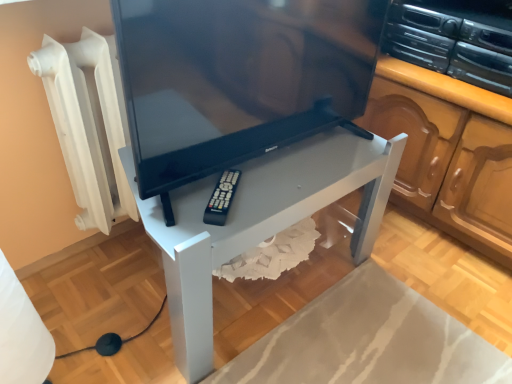
Where is `white glossy table at center`? This screenshot has height=384, width=512. white glossy table at center is located at coordinates (259, 221).

This screenshot has width=512, height=384. What do you see at coordinates (222, 198) in the screenshot?
I see `black plastic remote at lower center` at bounding box center [222, 198].

In order to face black plastic remote at lower center, should I rotate leftwards or rightwards?

It's best to rotate left around 4.134 degrees.

At what (x,y) coordinates should I click in order to perform the action: click on white glossy table at center. Please return your answer as a coordinate pair (x, y). The height and width of the screenshot is (384, 512). Looking at the image, I should click on (259, 221).

Is white glossy table at center far from black glossy tv at center?

That's not correct — white glossy table at center is a little close to black glossy tv at center.

Between white glossy table at center and black glossy tv at center, which one appears on the right side from the viewer's perspective?

From the viewer's perspective, black glossy tv at center appears more on the right side.

From the image's perspective, is white glossy table at center under black glossy tv at center?

Yes, from the image's perspective, white glossy table at center is beneath black glossy tv at center.

Can you see black glossy tv at center touching black plastic remote at lower center?

No, black glossy tv at center is not in contact with black plastic remote at lower center.

Based on the photo, is black glossy tv at center to the right of black plastic remote at lower center from the viewer's perspective?

Yes, black glossy tv at center is to the right of black plastic remote at lower center.

Could black plastic remote at lower center be considered to be inside black glossy tv at center?

Yes, black plastic remote at lower center is a part of black glossy tv at center.

From the image's perspective, would you say black glossy tv at center is positioned over black plastic stereo at upper right?

Actually, black glossy tv at center appears below black plastic stereo at upper right in the image.

Which point is more distant from viewer, (294,46) or (401,14)?

Point (401,14)

Is black glossy tv at center oriented away from black plastic stereo at upper right?

No, black plastic stereo at upper right is not at the back of black glossy tv at center.

Considering the sizes of black plastic remote at lower center and black plastic stereo at upper right in the image, is black plastic remote at lower center wider or thinner than black plastic stereo at upper right?

Clearly, black plastic remote at lower center has less width compared to black plastic stereo at upper right.

What's the angular difference between black plastic remote at lower center and black plastic stereo at upper right's facing directions?

The angular difference between black plastic remote at lower center and black plastic stereo at upper right is 39.2 degrees.

Consider the image. Can we say black plastic remote at lower center lies outside black plastic stereo at upper right?

black plastic remote at lower center is positioned outside black plastic stereo at upper right.

Is black plastic remote at lower center at the right side of black plastic stereo at upper right?

Incorrect, black plastic remote at lower center is not on the right side of black plastic stereo at upper right.

From a real-world perspective, who is located lower, black glossy tv at center or white glossy table at center?

In real-world perspective, white glossy table at center is lower.

In the scene shown: How many degrees apart are the facing directions of black glossy tv at center and white glossy table at center?

The angle between the facing direction of black glossy tv at center and the facing direction of white glossy table at center is 2.98 degrees.

Is black glossy tv at center touching white glossy table at center?

No, black glossy tv at center is not beside white glossy table at center.

You are a GUI agent. You are given a task and a screenshot of the screen. Output one action in this format:
    pyautogui.click(x=<x>, y=<y>)
    Task: Click on the television above the white glossy table at center (from a real-world perspective)
    Image resolution: width=512 pixels, height=384 pixels.
    Given the screenshot: What is the action you would take?
    pyautogui.click(x=238, y=78)

From a real-world perspective, which is physically above, black plastic remote at lower center or black glossy tv at center?

black glossy tv at center, from a real-world perspective.

Is point (217, 217) positioned behind point (357, 126)?

No, it is in front of (357, 126).

Does black plastic remote at lower center have a greater height compared to black glossy tv at center?

No.

Is white glossy table at center bigger than black plastic remote at lower center?

Indeed, white glossy table at center has a larger size compared to black plastic remote at lower center.

Locate an element on the screen. The height and width of the screenshot is (384, 512). equipment located behind the white glossy table at center is located at coordinates (222, 198).

Is white glossy table at center in contact with black plastic remote at lower center?

white glossy table at center and black plastic remote at lower center are not in contact.

The width and height of the screenshot is (512, 384). Identify the location of television in front of the white glossy table at center. (238, 78).

Find the location of `equipment below the black glossy tv at center (from the image's perspective)`. equipment below the black glossy tv at center (from the image's perspective) is located at coordinates (222, 198).

Which object lies nearer to the anchor point black glossy tv at center, black plastic stereo at upper right or white glossy table at center?

white glossy table at center is positioned closer to the anchor black glossy tv at center.

When comparing their distances from black glossy tv at center, does white glossy table at center or black plastic remote at lower center seem further?

black plastic remote at lower center is positioned further to the anchor black glossy tv at center.

Looking at the image, which one is located further to black plastic remote at lower center, black plastic stereo at upper right or white glossy table at center?

black plastic stereo at upper right lies further to black plastic remote at lower center than the other object.

Based on their spatial positions, is black glossy tv at center or black plastic remote at lower center closer to black plastic stereo at upper right?

black glossy tv at center lies closer to black plastic stereo at upper right than the other object.

When comparing their distances from black plastic remote at lower center, does white glossy table at center or black glossy tv at center seem further?

black glossy tv at center.

Looking at the image, which one is located closer to black glossy tv at center, black plastic remote at lower center or black plastic stereo at upper right?

black plastic remote at lower center is positioned closer to the anchor black glossy tv at center.

When comparing their distances from black plastic remote at lower center, does black glossy tv at center or white glossy table at center seem further?

Among the two, black glossy tv at center is located further to black plastic remote at lower center.

Estimate the real-world distances between objects in this image. Which object is further from white glossy table at center, black plastic stereo at upper right or black plastic remote at lower center?

Based on the image, black plastic stereo at upper right appears to be further to white glossy table at center.

The height and width of the screenshot is (384, 512). What are the coordinates of `television between black plastic remote at lower center and black plastic stereo at upper right from left to right` in the screenshot? It's located at (238, 78).

At what (x,y) coordinates should I click in order to perform the action: click on furniture between black plastic remote at lower center and black plastic stereo at upper right. Please return your answer as a coordinate pair (x, y). The height and width of the screenshot is (384, 512). Looking at the image, I should click on (259, 221).

Identify the location of equipment between black glossy tv at center and white glossy table at center in the vertical direction. The image size is (512, 384). (222, 198).

You are a GUI agent. You are given a task and a screenshot of the screen. Output one action in this format:
    pyautogui.click(x=<x>, y=<y>)
    Task: Click on the television between white glossy table at center and black plastic stereo at upper right in the horizontal direction
    The width and height of the screenshot is (512, 384).
    Given the screenshot: What is the action you would take?
    pyautogui.click(x=238, y=78)